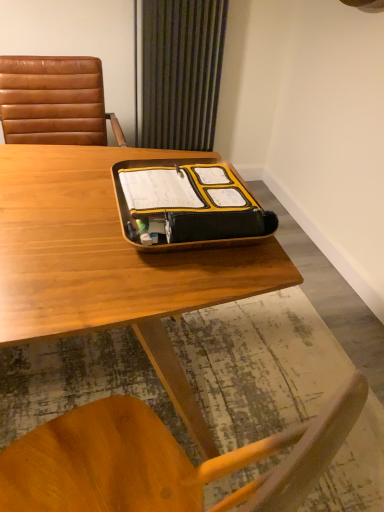
Question: Is wooden desk at center to the left of brown leather chair at left from the viewer's perspective?

Choices:
 (A) no
 (B) yes

Answer: (A)

Question: Is wooden desk at center thinner than brown leather chair at left?

Choices:
 (A) yes
 (B) no

Answer: (B)

Question: From the image's perspective, is wooden desk at center over brown leather chair at left?

Choices:
 (A) yes
 (B) no

Answer: (B)

Question: From a real-world perspective, is wooden desk at center below brown leather chair at left?

Choices:
 (A) no
 (B) yes

Answer: (B)

Question: Can you confirm if wooden desk at center is smaller than brown leather chair at left?

Choices:
 (A) yes
 (B) no

Answer: (B)

Question: Which is correct: yellow matte tray at center is inside brown leather chair at left, or outside of it?

Choices:
 (A) outside
 (B) inside

Answer: (A)

Question: Does point (180, 178) appear closer or farther from the camera than point (69, 138)?

Choices:
 (A) farther
 (B) closer

Answer: (B)

Question: Is yellow matte tray at center to the left or to the right of brown leather chair at left in the image?

Choices:
 (A) left
 (B) right

Answer: (B)

Question: In terms of size, does yellow matte tray at center appear bigger or smaller than brown leather chair at left?

Choices:
 (A) small
 (B) big

Answer: (A)

Question: Considering their positions, is green striped curtain at upper center located in front of or behind yellow matte tray at center?

Choices:
 (A) front
 (B) behind

Answer: (B)

Question: Is green striped curtain at upper center spatially inside yellow matte tray at center, or outside of it?

Choices:
 (A) outside
 (B) inside

Answer: (A)

Question: Does point (201, 80) appear closer or farther from the camera than point (162, 237)?

Choices:
 (A) farther
 (B) closer

Answer: (A)

Question: From the image's perspective, is green striped curtain at upper center positioned above or below yellow matte tray at center?

Choices:
 (A) above
 (B) below

Answer: (A)

Question: Visually, is brown leather chair at left positioned to the left or to the right of green striped curtain at upper center?

Choices:
 (A) right
 (B) left

Answer: (B)

Question: Considering the positions of brown leather chair at left and green striped curtain at upper center in the image, is brown leather chair at left wider or thinner than green striped curtain at upper center?

Choices:
 (A) wide
 (B) thin

Answer: (A)